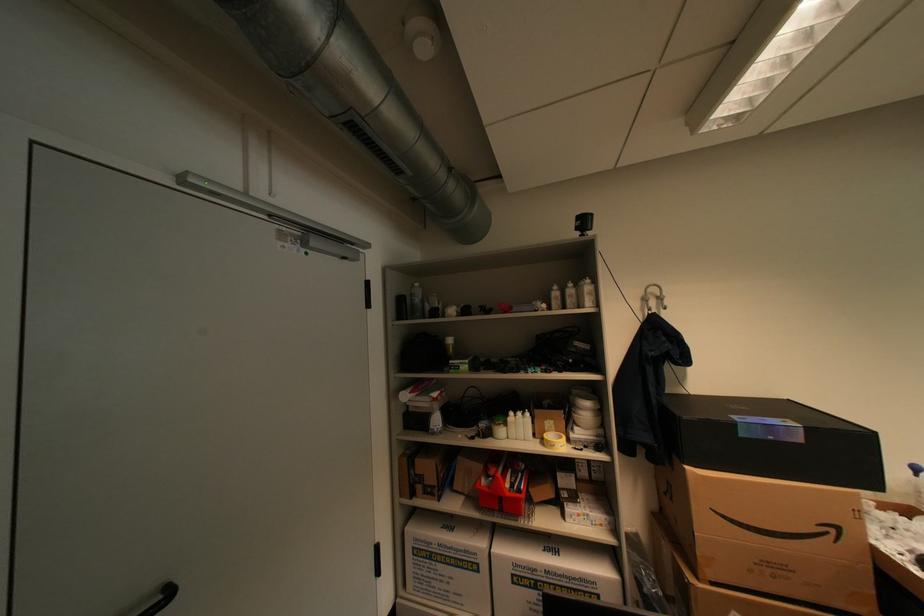
Locate an element on the screen. white bottle cap is located at coordinates (421, 37).